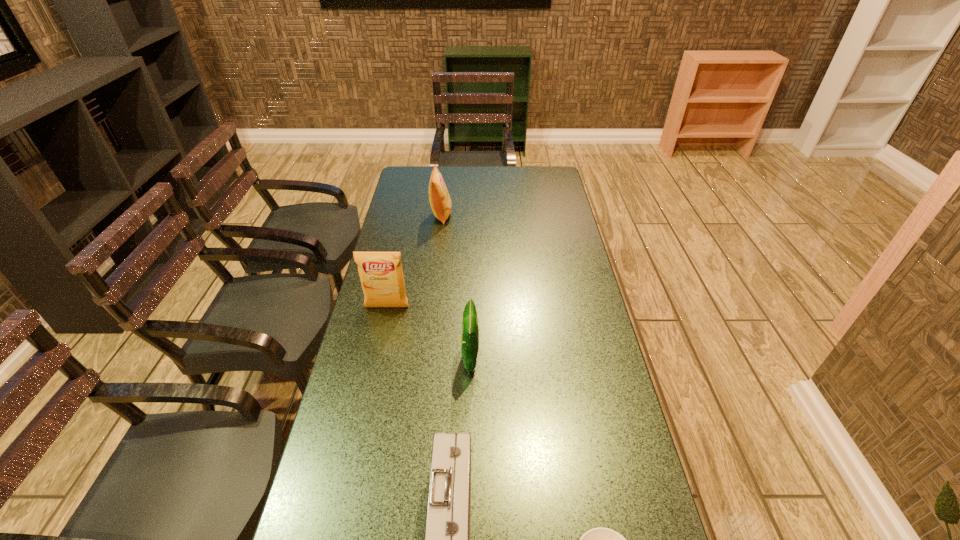
This screenshot has width=960, height=540. I want to click on vacant space at the far edge of the desktop, so click(500, 180).

This screenshot has width=960, height=540. Find the location of `vacant area at the left edge`. vacant area at the left edge is located at coordinates (396, 213).

Locate an element on the screen. The height and width of the screenshot is (540, 960). free space at the right edge is located at coordinates (604, 451).

The width and height of the screenshot is (960, 540). In the image, there is a desktop. Identify the location of blank space at the far left corner. [398, 186].

Find the location of a particular element. The width and height of the screenshot is (960, 540). free spot between the second crisp (potato chip) from left to right and the fourth nearest object is located at coordinates (415, 261).

Locate an element on the screen. free area in between the second farthest object and the rightmost crisp (potato chip) is located at coordinates (429, 333).

Image resolution: width=960 pixels, height=540 pixels. In order to click on unoccupied area between the third nearest object and the second nearest crisp (potato chip) in this screenshot , I will do `click(429, 333)`.

This screenshot has width=960, height=540. I want to click on free spot between the second nearest crisp (potato chip) and the farthest crisp (potato chip), so click(x=415, y=261).

Locate an element on the screen. object that is the third closest to the rightmost crisp (potato chip) is located at coordinates (600, 539).

Where is `object that stands as the second closest to the fourth tallest object`? The image size is (960, 540). object that stands as the second closest to the fourth tallest object is located at coordinates (470, 331).